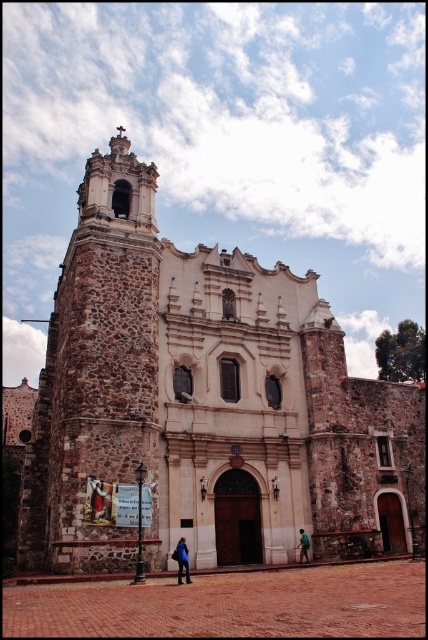
Question: Which object appears farthest from the camera in this image?

Choices:
 (A) green fabric person at center
 (B) stone church at center

Answer: (A)

Question: Which object is farther from the camera taking this photo?

Choices:
 (A) blue denim jacket at lower center
 (B) blue fabric at lower center
 (C) stone church at center

Answer: (A)

Question: Can you confirm if stone church at center is thinner than green fabric person at center?

Choices:
 (A) yes
 (B) no

Answer: (B)

Question: Which object appears farthest from the camera in this image?

Choices:
 (A) green fabric person at center
 (B) stone church at center

Answer: (A)

Question: Is stone church at center positioned at the back of green fabric person at center?

Choices:
 (A) yes
 (B) no

Answer: (B)

Question: Does stone church at center appear under blue denim jacket at lower center?

Choices:
 (A) yes
 (B) no

Answer: (B)